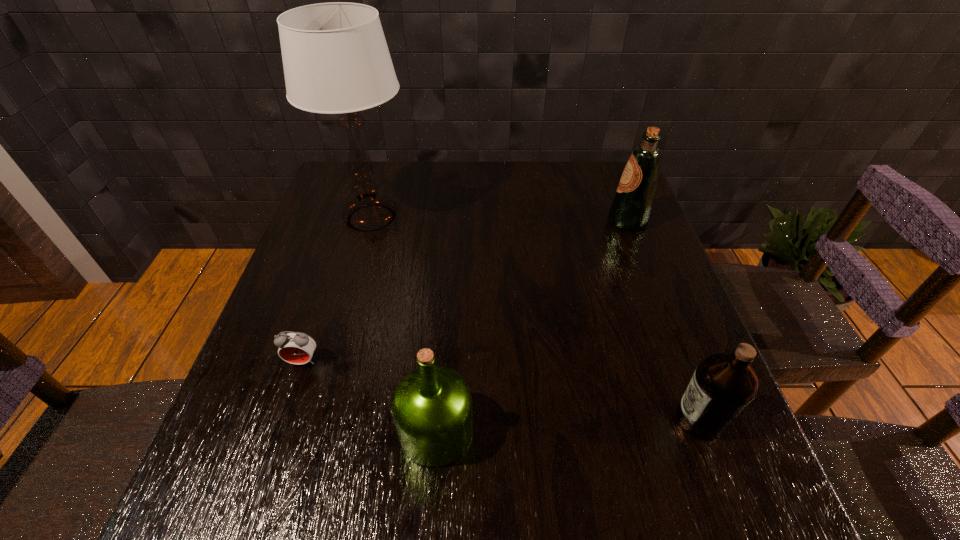
You are a GUI agent. You are given a task and a screenshot of the screen. Output one action in this format:
    pyautogui.click(x=<x>, y=<y>)
    Task: Click on the vacant area situated on the face of the alarm clock
    The image size is (960, 540).
    Given the screenshot: What is the action you would take?
    pyautogui.click(x=252, y=516)

At what (x,y) coordinates should I click in order to perform the action: click on object present at the far edge. Please return your answer as a coordinate pair (x, y). This screenshot has width=960, height=540. Looking at the image, I should click on (336, 60).

The image size is (960, 540). Identify the location of object at the near edge. (431, 406).

You are a GUI agent. You are given a task and a screenshot of the screen. Output one action in this format:
    pyautogui.click(x=<x>, y=<y>)
    Task: Click on the table lamp situated at the left edge
    The image size is (960, 540).
    Given the screenshot: What is the action you would take?
    pyautogui.click(x=336, y=60)

Where is `alarm clock located in the left edge section of the desktop`? Image resolution: width=960 pixels, height=540 pixels. alarm clock located in the left edge section of the desktop is located at coordinates (297, 348).

You are a GUI agent. You are given a task and a screenshot of the screen. Output one action in this format:
    pyautogui.click(x=<x>, y=<y>)
    Task: Click on the object that is at the far left corner
    This screenshot has width=960, height=540.
    Given the screenshot: What is the action you would take?
    pyautogui.click(x=336, y=60)

The width and height of the screenshot is (960, 540). In the image, there is a desktop. Identify the location of vacant space at the far edge. [x=571, y=197].

Where is `vacant space at the left edge`? The width and height of the screenshot is (960, 540). vacant space at the left edge is located at coordinates (257, 427).

Identify the location of vacant space at the right edge. This screenshot has width=960, height=540. (602, 234).

Find the location of `vacant area at the far left corner of the desktop`. vacant area at the far left corner of the desktop is located at coordinates (376, 168).